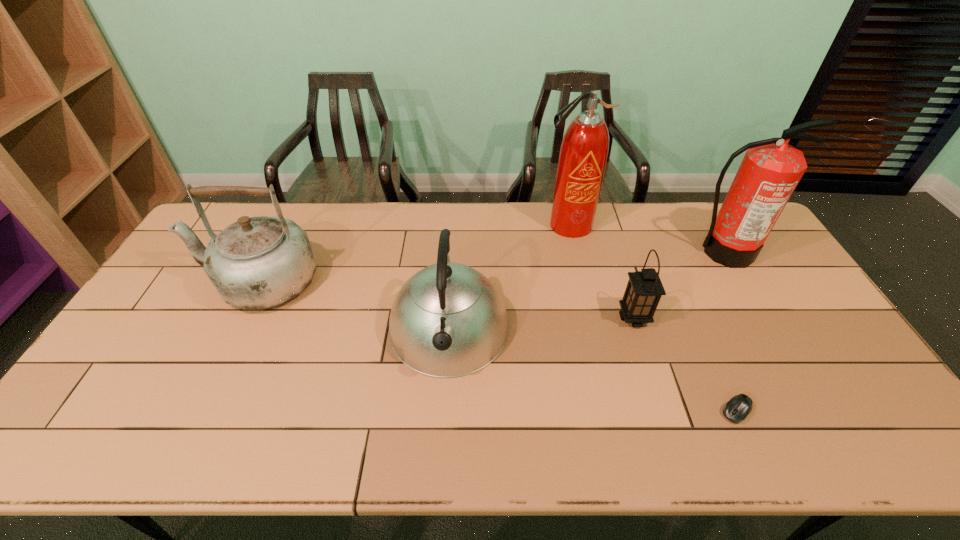
Where is `blank region between the fifth object from left to right and the second object from left to right`? Image resolution: width=960 pixels, height=540 pixels. blank region between the fifth object from left to right and the second object from left to right is located at coordinates (592, 370).

The image size is (960, 540). Find the location of `empty space between the lantern and the right kettle`. empty space between the lantern and the right kettle is located at coordinates (541, 323).

Identify the location of free space between the second shortest object and the shorter kettle. The height and width of the screenshot is (540, 960). (541, 323).

Select which object appears as the fifth closest to the right kettle. Please provide its 2D coordinates. Your answer should be formatted as a tuple, i.e. [(x, y)], where the tuple contains the x and y coordinates of a point satisfying the conditions above.

[(771, 169)]

Identify the location of object that is the closest to the second shortest object. Image resolution: width=960 pixels, height=540 pixels. (738, 408).

Find the location of `free space that satisfies the following two spatial constraints: 1. at the spout of the left fire extinguisher; 2. on the right side of the left kettle`. free space that satisfies the following two spatial constraints: 1. at the spout of the left fire extinguisher; 2. on the right side of the left kettle is located at coordinates (287, 225).

This screenshot has height=540, width=960. What are the coordinates of `vacant space that satisfies the following two spatial constraints: 1. at the spout of the left fire extinguisher; 2. on the left side of the taller kettle` in the screenshot? It's located at (287, 225).